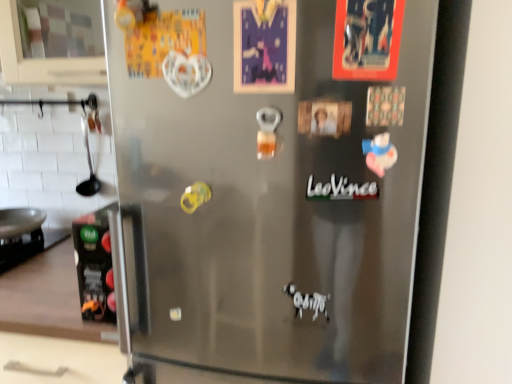
Question: From the image's perspective, is black matte carton at left positioned above or below satin silver fridge at center?

Choices:
 (A) below
 (B) above

Answer: (A)

Question: Considering the positions of black matte carton at left and satin silver fridge at center in the image, is black matte carton at left taller or shorter than satin silver fridge at center?

Choices:
 (A) short
 (B) tall

Answer: (A)

Question: Estimate the real-world distances between objects in this image. Which object is farther from the black matte carton at left?

Choices:
 (A) satin silver fridge at center
 (B) black matte text at center

Answer: (A)

Question: Which object is the closest to the black matte text at center?

Choices:
 (A) black matte carton at left
 (B) satin silver fridge at center

Answer: (A)